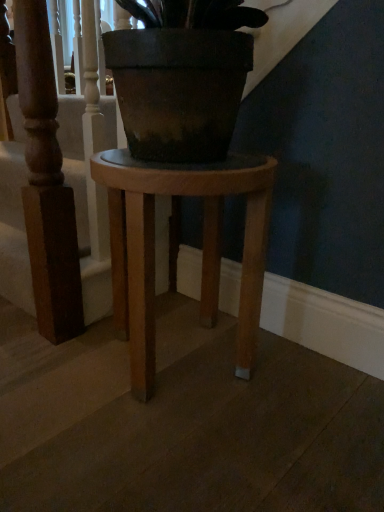
You are a GUI agent. You are given a task and a screenshot of the screen. Output one action in this format:
    pyautogui.click(x=<x>, y=<y>)
    Task: Click on the vacant area that lies to the right of wooden stool at center
    
    Given the screenshot: What is the action you would take?
    pyautogui.click(x=309, y=391)